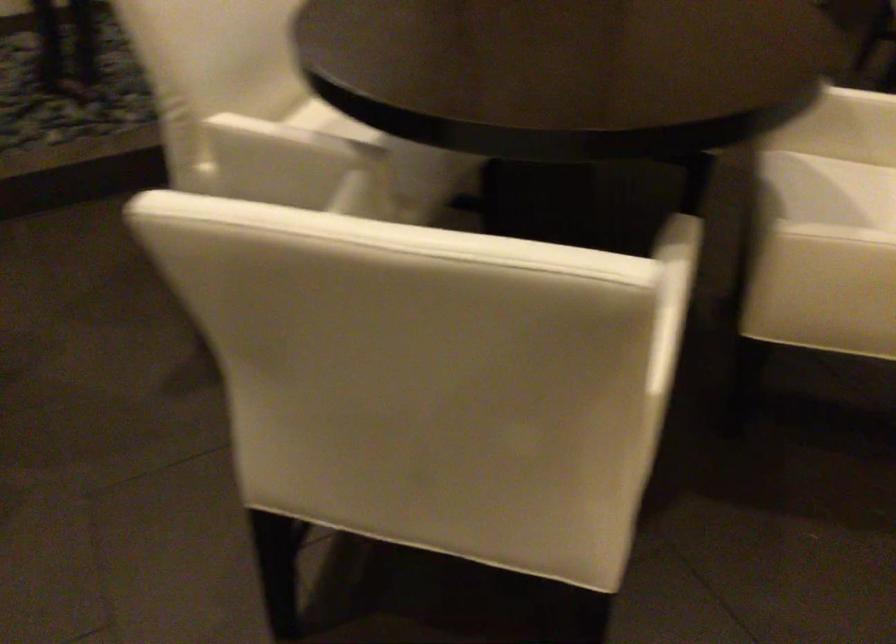
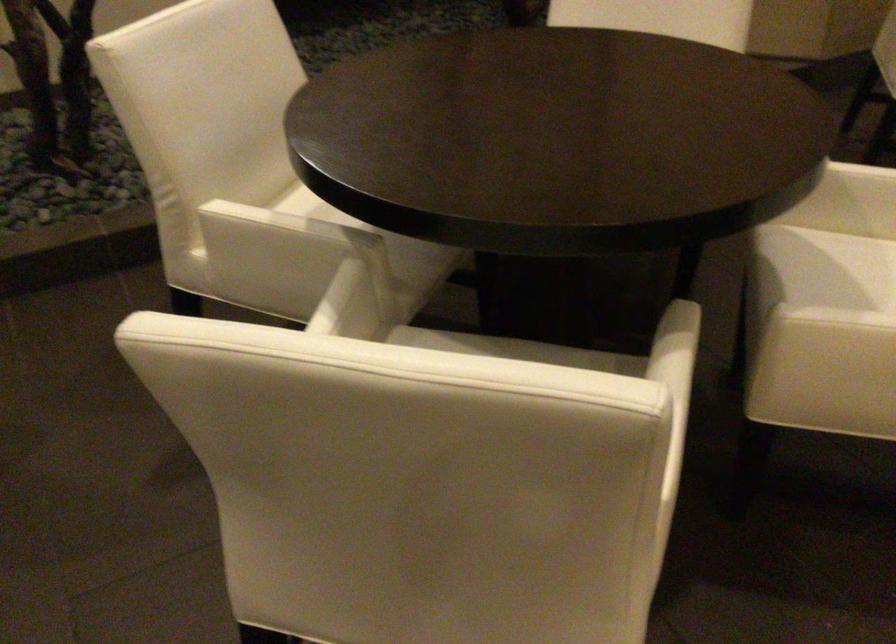
Locate, in the second image, the point that corresponds to [355,213] in the first image.

(348, 305)